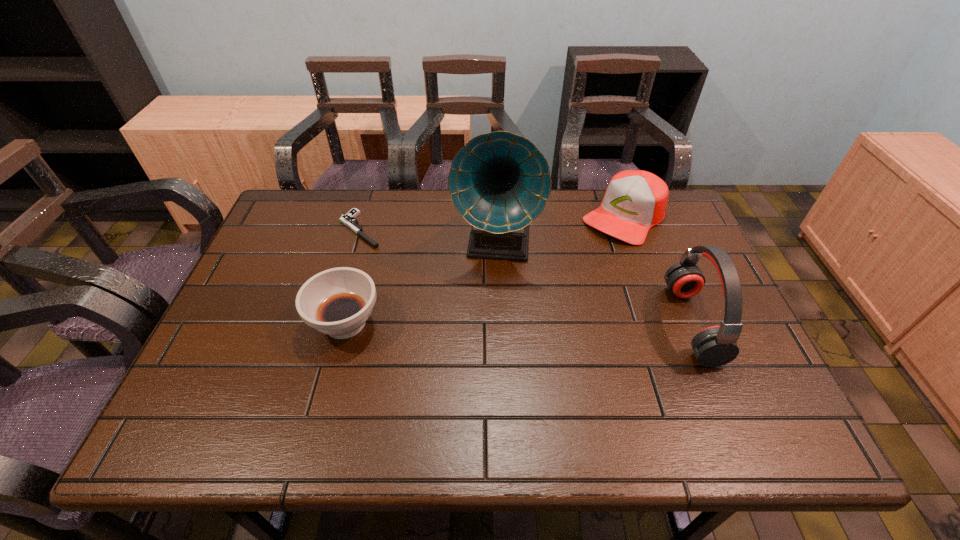
You are a GUI agent. You are given a task and a screenshot of the screen. Output one action in this format:
    pyautogui.click(x=<x>, y=<y>)
    Task: Click on the object situated at the near edge
    This screenshot has height=540, width=960.
    Given the screenshot: What is the action you would take?
    pyautogui.click(x=714, y=346)

At what (x,y) coordinates should I click in order to perform the action: click on earphone that is at the right edge. Please return your answer as a coordinate pair (x, y). The image size is (960, 540). Looking at the image, I should click on (714, 346).

Locate an element on the screen. The height and width of the screenshot is (540, 960). baseball cap situated at the right edge is located at coordinates (635, 200).

At what (x,y) coordinates should I click in order to perform the action: click on object at the far right corner. Please return your answer as a coordinate pair (x, y). The image size is (960, 540). Looking at the image, I should click on (635, 200).

Find the location of a particular element. object that is at the near right corner is located at coordinates (714, 346).

Identify the location of free point at the far edge. (430, 201).

This screenshot has height=540, width=960. What are the coordinates of `free region at the near edge of the desktop` in the screenshot? It's located at (331, 372).

The image size is (960, 540). In order to click on free space at the left edge in this screenshot , I will do `click(272, 239)`.

This screenshot has width=960, height=540. I want to click on free space at the right edge of the desktop, so click(679, 330).

At what (x,y) coordinates should I click in order to perform the action: click on vacant space at the far left corner of the desktop. Please return your answer as a coordinate pair (x, y). This screenshot has width=960, height=540. Looking at the image, I should click on (306, 236).